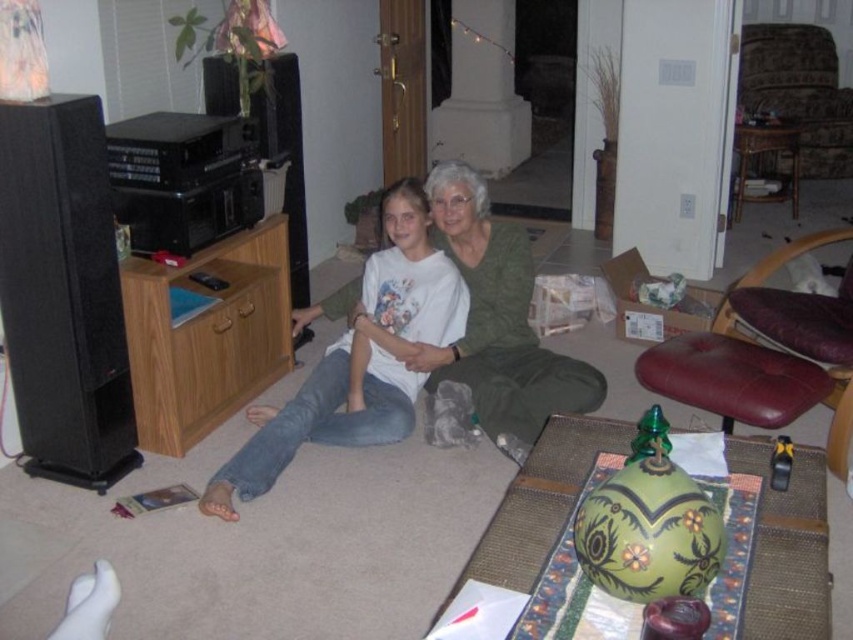
You are trying to reach the patterned fabric ottoman at upper right from where you are standing. Is the green textured sweater at center in your way?

Yes, the green textured sweater at center is closer to you than the patterned fabric ottoman at upper right, so it is blocking your path.

You are a delivery person who needs to place a small package between the green textured sweater at center and the patterned fabric ottoman at upper right. Can you fit it there?

The green textured sweater at center is shorter than the patterned fabric ottoman at upper right, so there might be enough space between them to place the small package.